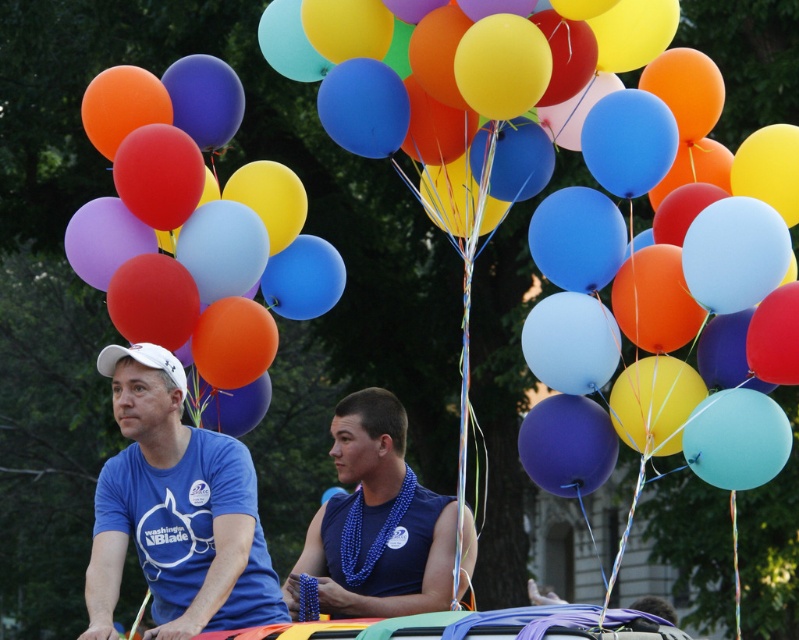
Consider the image. Is matte blue balloon at center bigger than matte blue t-shirt at left?

Correct, matte blue balloon at center is larger in size than matte blue t-shirt at left.

Which is in front, point (211, 228) or point (221, 564)?

Point (221, 564) is in front.

At what (x,y) coordinates should I click in order to perform the action: click on matte blue balloon at center. Please return your answer as a coordinate pair (x, y). The image size is (799, 640). Looking at the image, I should click on (586, 202).

Is point (126, 518) positioned before point (400, 419)?

Yes, point (126, 518) is in front of point (400, 419).

Is matte blue t-shirt at left to the right of blue beaded necklace at center from the viewer's perspective?

Incorrect, matte blue t-shirt at left is not on the right side of blue beaded necklace at center.

What do you see at coordinates (175, 509) in the screenshot? The image size is (799, 640). I see `matte blue t-shirt at left` at bounding box center [175, 509].

Where is `matte blue t-shirt at left`? matte blue t-shirt at left is located at coordinates (175, 509).

Who is lower down, matte blue balloon at center or blue beaded necklace at center?

blue beaded necklace at center is below.

Who is more forward, (x=644, y=163) or (x=420, y=586)?

Positioned in front is point (x=644, y=163).

The width and height of the screenshot is (799, 640). In order to click on matte blue balloon at center in this screenshot , I will do `click(586, 202)`.